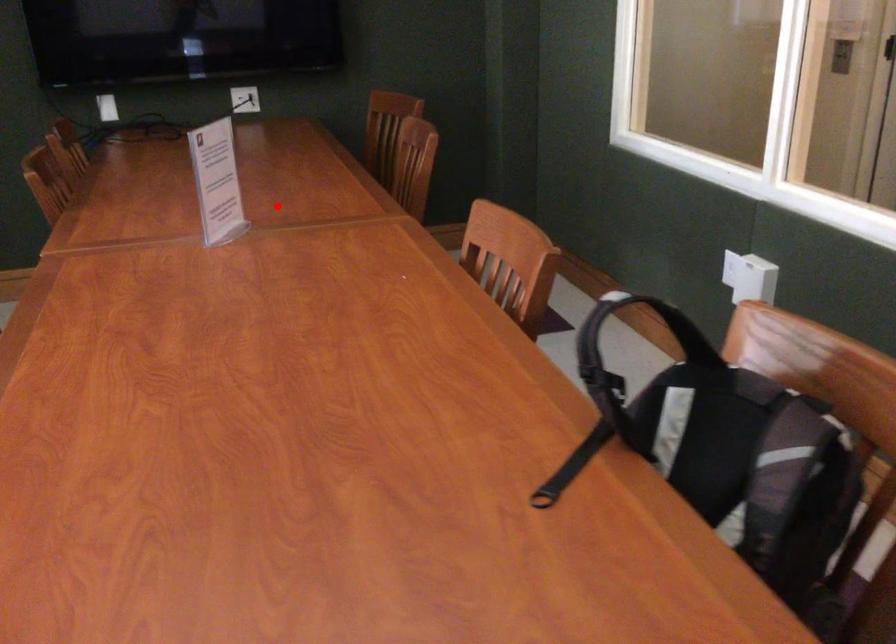
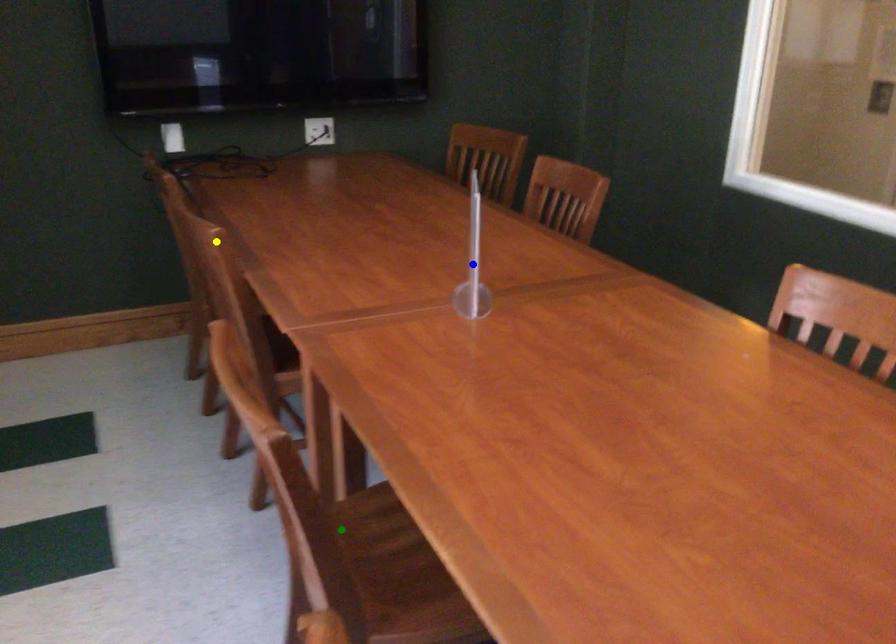
Question: I am providing you with two images of the same scene from different viewpoints. A red point is marked on the first image. You are given multiple points on the second image. Which mark in image 2 goes with the point in image 1?

Choices:
 (A) yellow point
 (B) blue point
 (C) green point

Answer: (B)